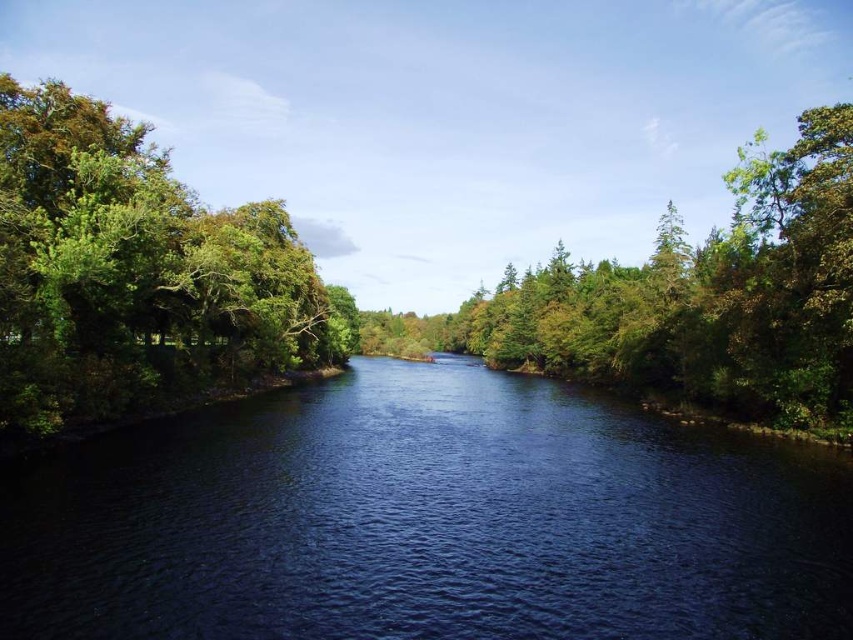
You are standing at the center of the image and want to locate the deep blue water at center. According to the coordinates provided, in which direction should you look to find it?

The deep blue water at center is located at coordinates point (427, 522), so you should look slightly to the right from the center point since the x coordinate is greater than 0.5.

Consider the image. You are standing at the point marked as point (15, 600) in the river scene. You want to walk straight towards the viewer. How far will you have to walk to reach the viewer?

The distance between point (15, 600) and the viewer is 36.46 meters, so you will have to walk 36.46 meters to reach the viewer.

You are a hiker standing at the edge of a river and want to cross it to reach the green leafy forest at center. The river is 30 meters wide. Can you safely cross the river to get there?

The distance between you and the green leafy forest at center is 61.19 meters. Since the river is only 30 meters wide, you can cross the river and reach the forest safely.